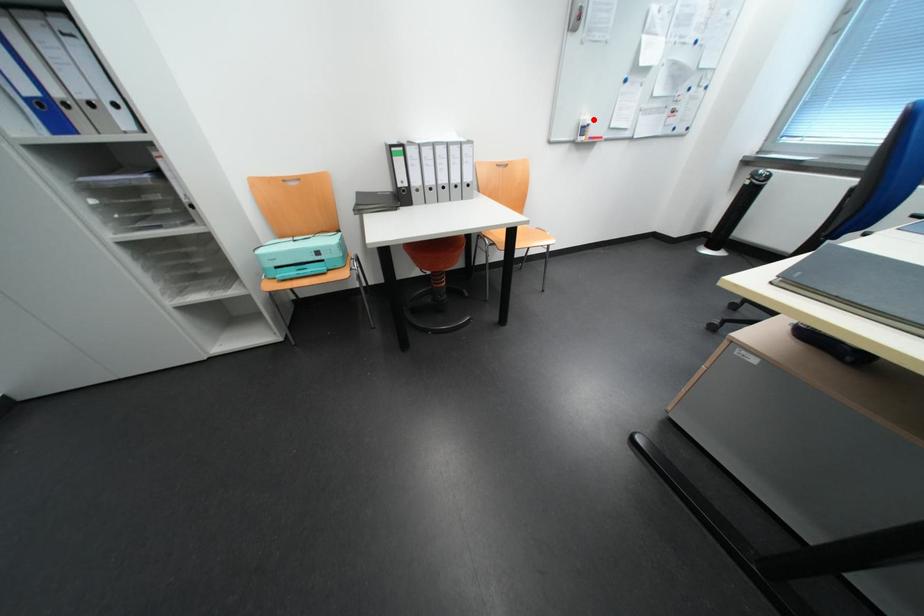
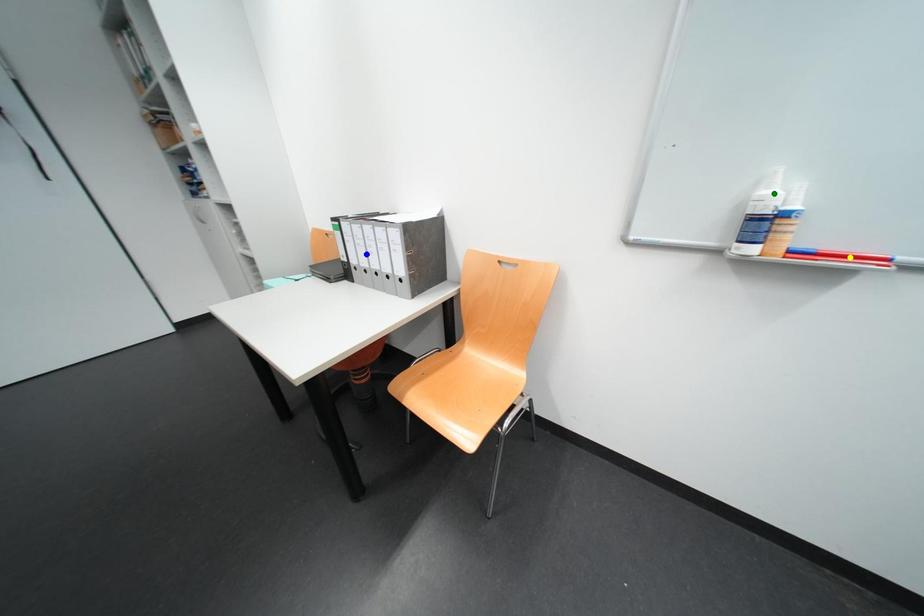
Question: I am providing you with two images of the same scene from different viewpoints. A red point is marked on the first image. You are given multiple points on the second image. Which mark in image 2 goes with the point in image 1?

Choices:
 (A) blue point
 (B) green point
 (C) yellow point

Answer: (B)